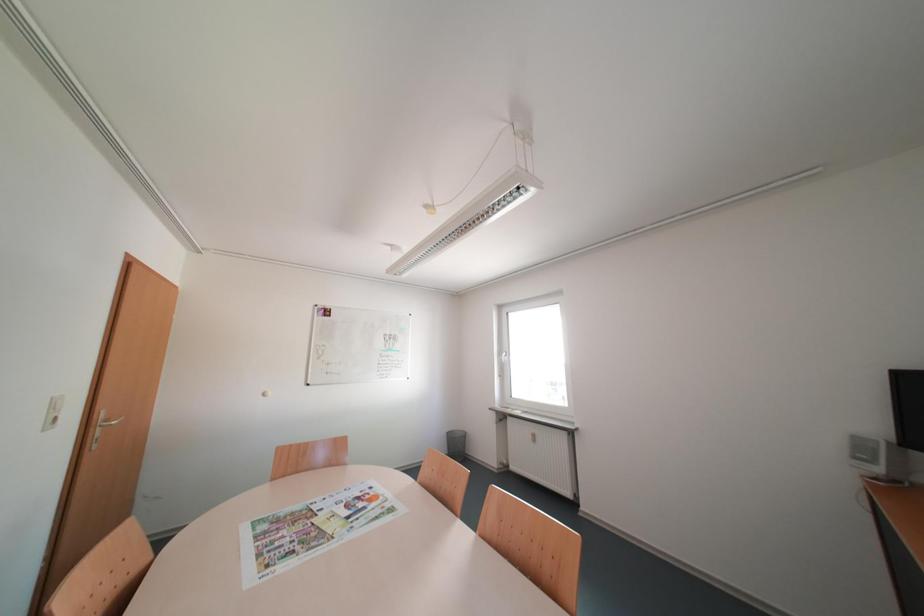
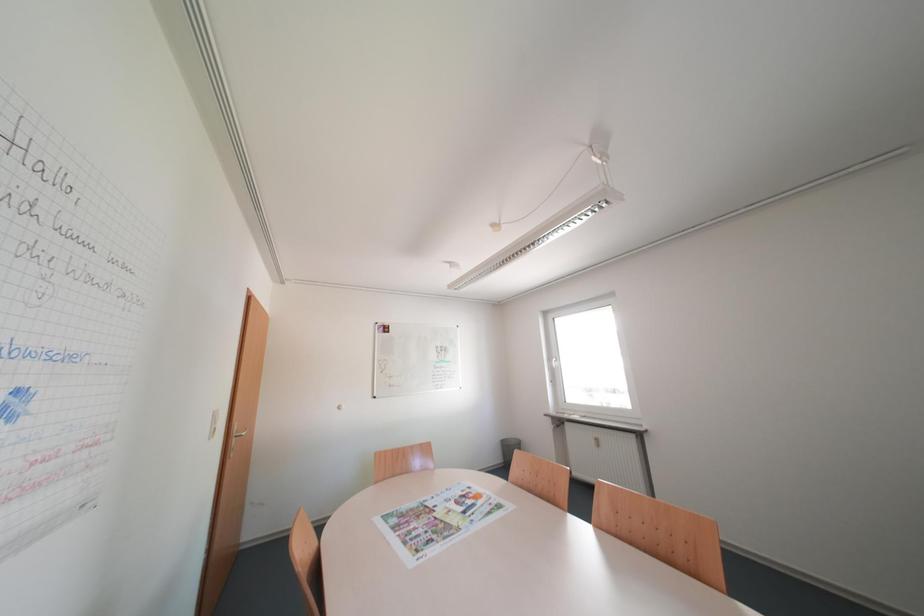
Question: The images are taken continuously from a first-person perspective. In which direction is your viewpoint rotating?

Choices:
 (A) Left
 (B) Right
 (C) Up
 (D) Down

Answer: (A)